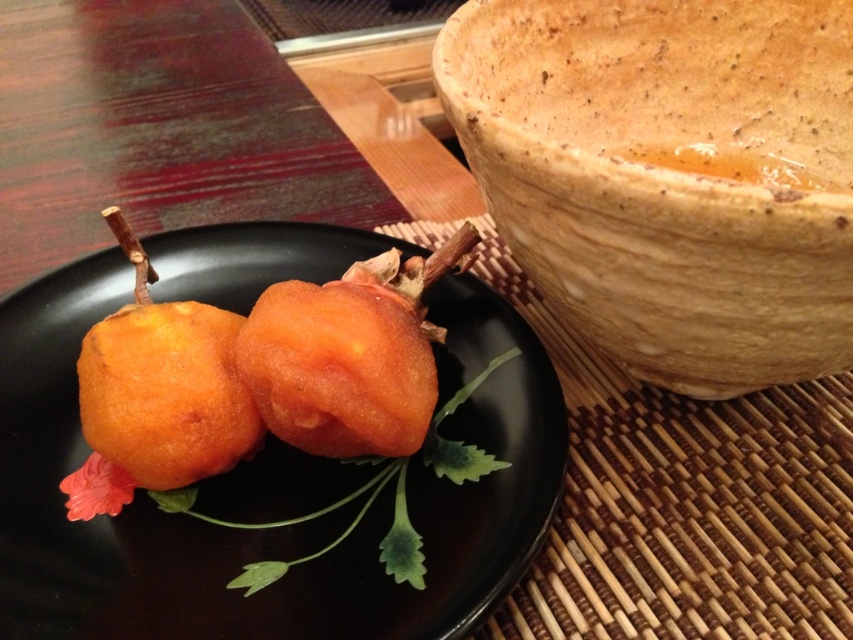
You are taking a photo of the speckled clay bowl at upper right and want to ensure it is in focus. If your camera has a depth of field that can sharply capture objects within 20 inches, will the bowl be in focus?

The speckled clay bowl at upper right is 21.79 inches away from the camera. Since the depth of field can only sharply capture objects within 20 inches, the bowl will be slightly out of focus.

You are a food photographer setting up a shot of the plate of food on the woven bamboo placemat. To ensure the speckled clay bowl at upper right is visible in the background, where should you position it relative to the plate?

The speckled clay bowl at upper right is located at point (668, 173), so you should position it towards the upper right area of the setup to ensure it appears in the background of the photograph.

You are a food critic evaluating this dish. You need to describe the arrangement of the orange matte fruit at center and the golden fried donut at center. Which one is placed higher on the plate?

The orange matte fruit at center is located above the golden fried donut at center, so it is placed higher on the plate.